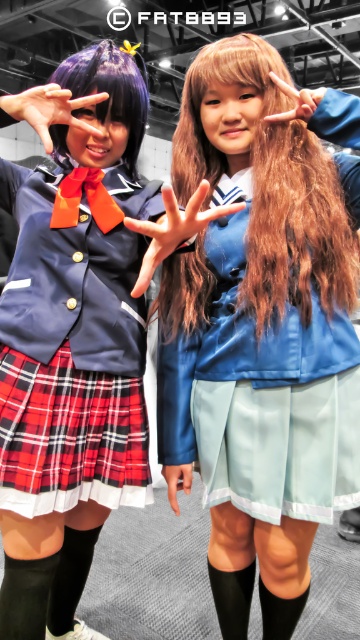
You are a photographer trying to adjust your camera focus. You notice two points in the image at coordinates point [11,312] and point [228,234]. Which point should you focus on first if you want to prioritize the one closer to the camera?

Point [11,312] is closer to the viewer than point [228,234], so you should focus on point [11,312] first.

You are standing 4 feet away from the camera. A point at coordinates point [59,435] is visible in the image. Can you reach that point without moving closer to the camera?

The distance of point [59,435] from camera is 3.74 feet. Since you are currently 4 feet away from the camera, you are farther than the point. Therefore, you cannot reach the point without moving closer to the camera.